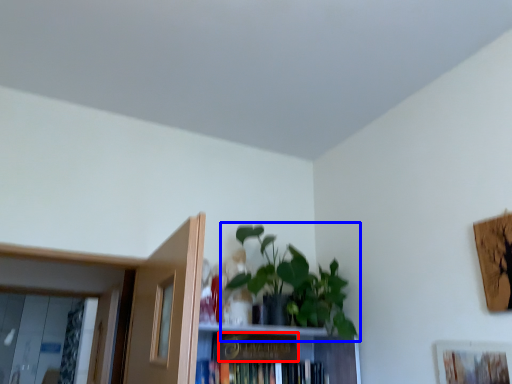
Question: Which object is further to the camera taking this photo, paperback book (highlighted by a red box) or houseplant (highlighted by a blue box)?

Choices:
 (A) paperback book
 (B) houseplant

Answer: (A)